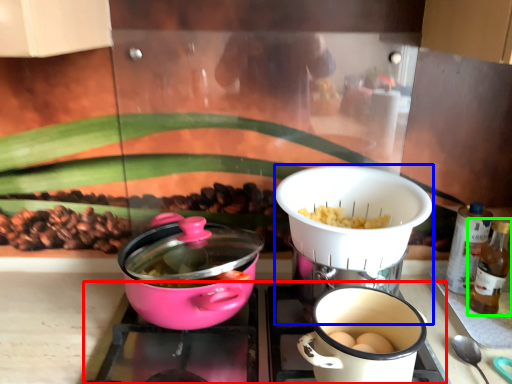
Question: Which object is positioned farthest from gas stove (highlighted by a red box)? Select from kitchen appliance (highlighted by a blue box) and bottle (highlighted by a green box).

Choices:
 (A) kitchen appliance
 (B) bottle

Answer: (B)